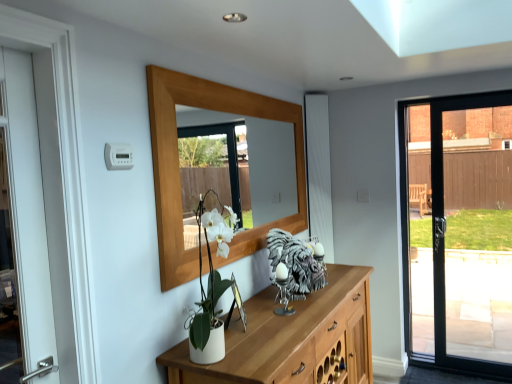
Question: From a real-world perspective, relative to metallic silver picture frame at center, is shiny silver sculpture at center vertically above or below?

Choices:
 (A) below
 (B) above

Answer: (B)

Question: Is shiny silver sculpture at center taller or shorter than metallic silver picture frame at center?

Choices:
 (A) short
 (B) tall

Answer: (B)

Question: Estimate the real-world distances between objects in this image. Which object is farther from the metallic silver picture frame at center?

Choices:
 (A) wooden mirror at upper center
 (B) shiny silver sculpture at center

Answer: (A)

Question: Estimate the real-world distances between objects in this image. Which object is closer to the wooden mirror at upper center?

Choices:
 (A) metallic silver picture frame at center
 (B) shiny silver sculpture at center

Answer: (B)